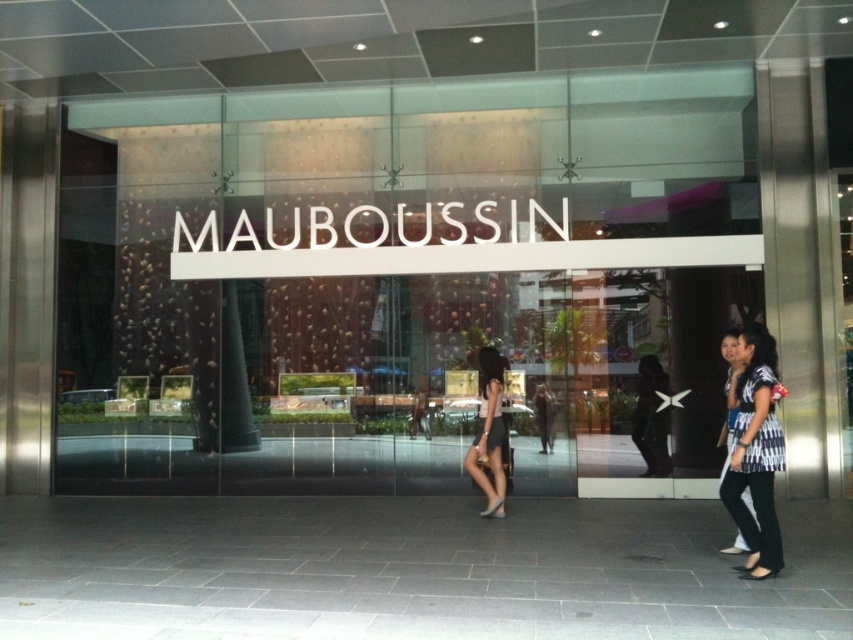
Question: From the image, what is the correct spatial relationship of striped fabric blouse at right in relation to matte white dress at center?

Choices:
 (A) left
 (B) right

Answer: (B)

Question: Is striped fabric blouse at right positioned in front of matte white dress at center?

Choices:
 (A) no
 (B) yes

Answer: (B)

Question: Which object appears closest to the camera in this image?

Choices:
 (A) striped fabric blouse at right
 (B) matte white dress at center

Answer: (A)

Question: Can you confirm if striped fabric blouse at right is thinner than matte white dress at center?

Choices:
 (A) no
 (B) yes

Answer: (B)